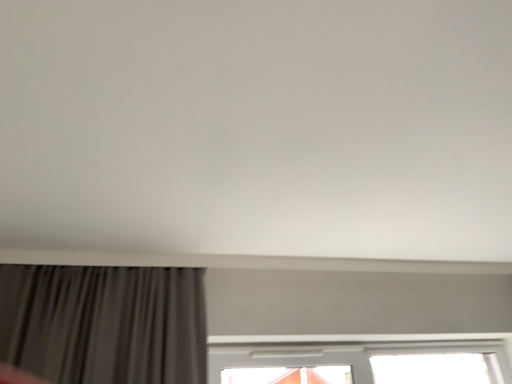
What do you see at coordinates (344, 351) in the screenshot? I see `white plastic window at lower center` at bounding box center [344, 351].

Where is `white plastic window at lower center`? The image size is (512, 384). white plastic window at lower center is located at coordinates [x=344, y=351].

Identify the location of white plastic window at lower center. This screenshot has height=384, width=512. [x=344, y=351].